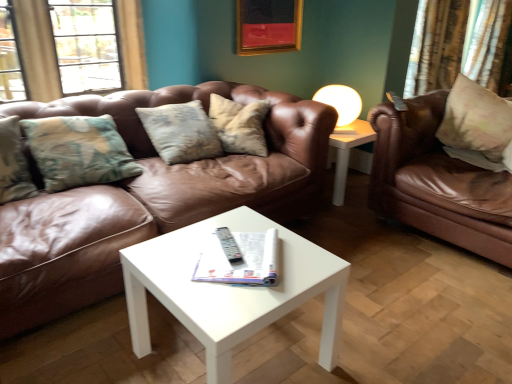
Where is `vacant area that is in front of black plastic remote at center`? The height and width of the screenshot is (384, 512). vacant area that is in front of black plastic remote at center is located at coordinates (225, 270).